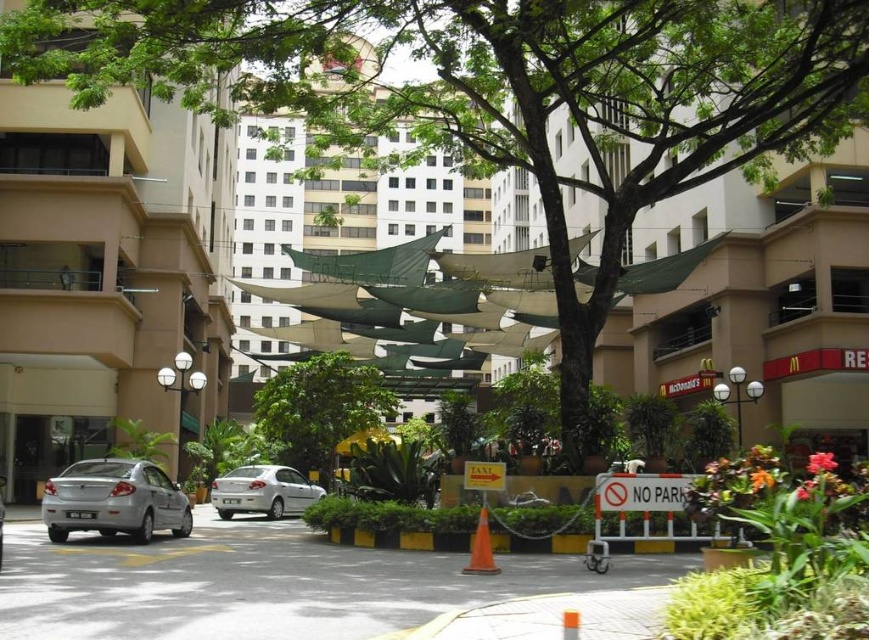
Question: Which of the following is the closest to the observer?

Choices:
 (A) (231, 506)
 (B) (327, 358)
 (C) (160, 524)
 (D) (24, 198)

Answer: (C)

Question: Is beige concrete building at left below silver metallic car at lower left?

Choices:
 (A) yes
 (B) no

Answer: (B)

Question: Estimate the real-world distances between objects in this image. Which object is farther from the silver metallic sedan at center?

Choices:
 (A) green leafy tree at center
 (B) silver metallic car at lower left
 (C) beige concrete building at left

Answer: (C)

Question: Does green leafy tree at center appear over silver metallic sedan at center?

Choices:
 (A) yes
 (B) no

Answer: (A)

Question: Among these objects, which one is farthest from the camera?

Choices:
 (A) green leafy tree at center
 (B) silver metallic sedan at center

Answer: (A)

Question: Can you confirm if silver metallic car at lower left is wider than silver metallic sedan at center?

Choices:
 (A) yes
 (B) no

Answer: (B)